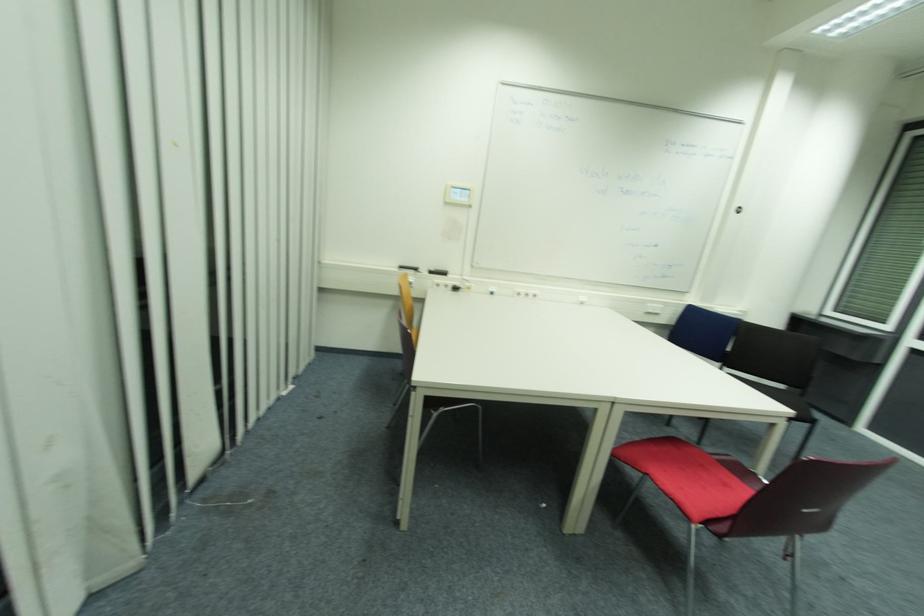
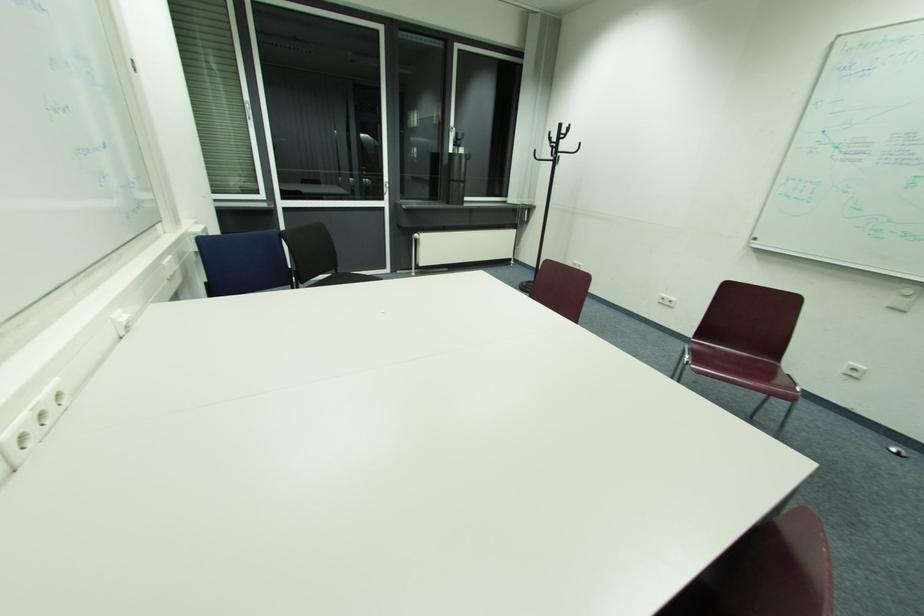
Question: I am providing you with two images of the same scene from different viewpoints. Which of the following objects are not visible in image2?

Choices:
 (A) blue metal cylinder
 (B) red chair sitting surface
 (C) black chair sitting surface
 (D) black cylindrical container

Answer: (B)